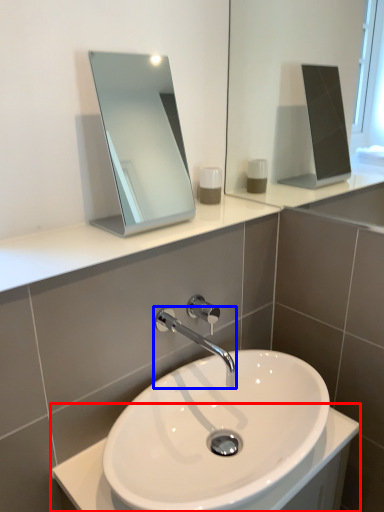
Question: Which object is closer to the camera taking this photo, counter top (highlighted by a red box) or tap (highlighted by a blue box)?

Choices:
 (A) counter top
 (B) tap

Answer: (A)